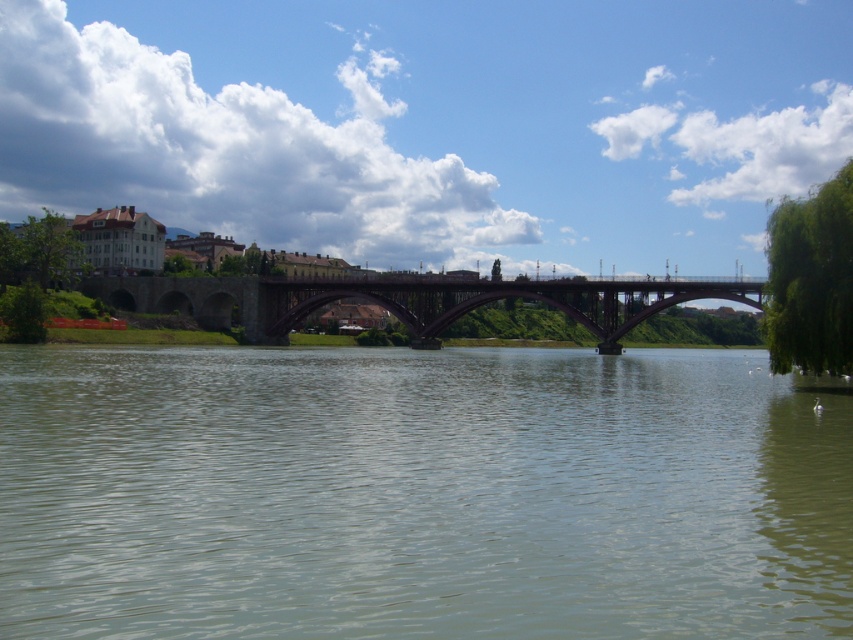
Is greenish water at center positioned before dark brown stone bridge at center?

Yes, greenish water at center is closer to the viewer.

Which of these two, greenish water at center or dark brown stone bridge at center, stands taller?

dark brown stone bridge at center is taller.

Who is more forward, (x=741, y=417) or (x=248, y=323)?

Point (x=741, y=417)

Locate an element on the screen. The image size is (853, 640). greenish water at center is located at coordinates (419, 493).